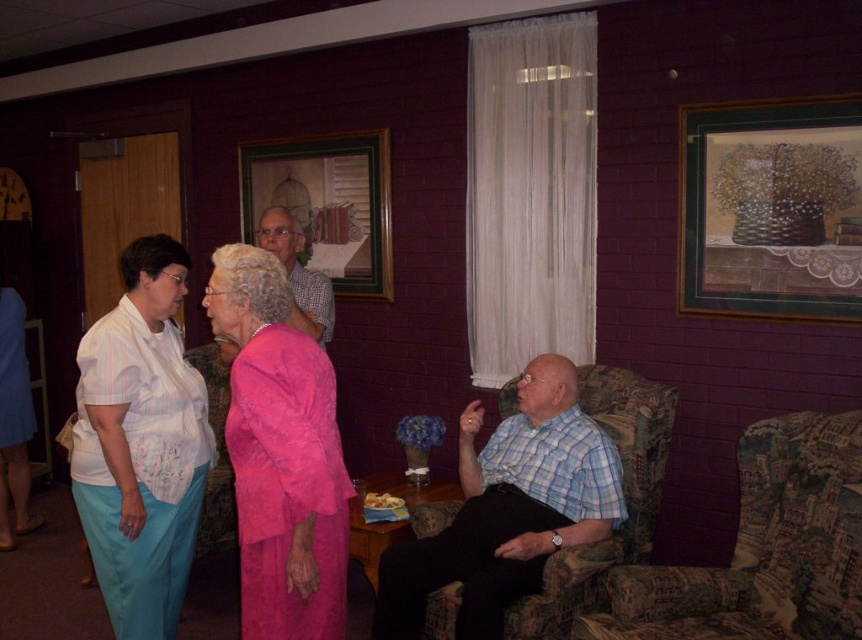
Looking at this image, can you confirm if blue plaid shirt at center is positioned below wooden frame at upper center?

Indeed, blue plaid shirt at center is positioned under wooden frame at upper center.

Is point (533, 509) less distant than point (353, 136)?

Yes, point (533, 509) is closer to viewer.

Is point (556, 355) positioned before point (323, 211)?

Yes, point (556, 355) is in front of point (323, 211).

Where is `blue plaid shirt at center`? This screenshot has height=640, width=862. blue plaid shirt at center is located at coordinates (508, 509).

Does matte white blouse at left appear under wooden frame at upper center?

Correct, matte white blouse at left is located below wooden frame at upper center.

Does matte white blouse at left appear over wooden frame at upper center?

Incorrect, matte white blouse at left is not positioned above wooden frame at upper center.

Locate an element on the screen. matte white blouse at left is located at coordinates (141, 444).

Does wooden framed artwork at upper right have a larger size compared to blue plaid shirt at center?

Incorrect, wooden framed artwork at upper right is not larger than blue plaid shirt at center.

Between point (842, 230) and point (591, 486), which one is positioned behind?

The point (842, 230) is more distant.

Where is `wooden framed artwork at upper right`? wooden framed artwork at upper right is located at coordinates (771, 209).